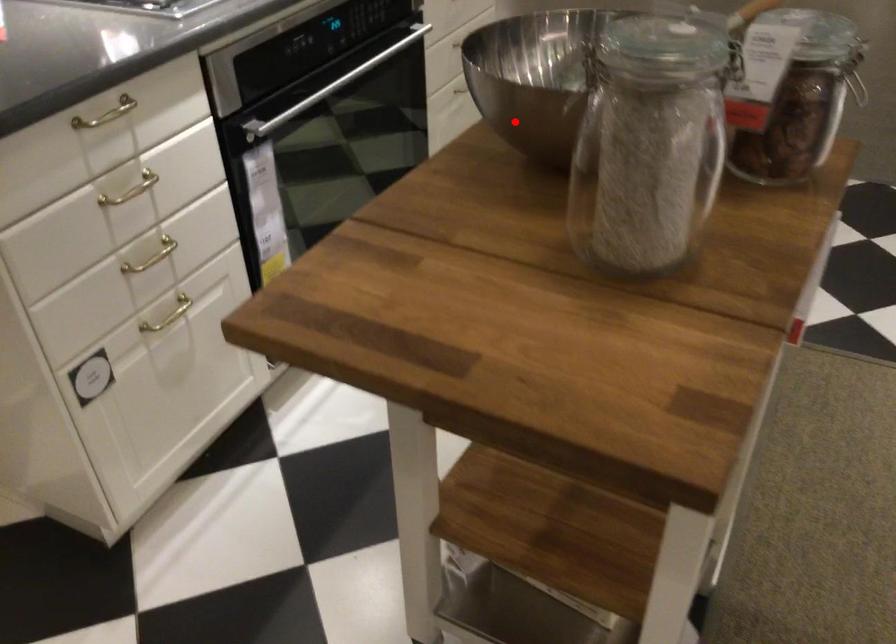
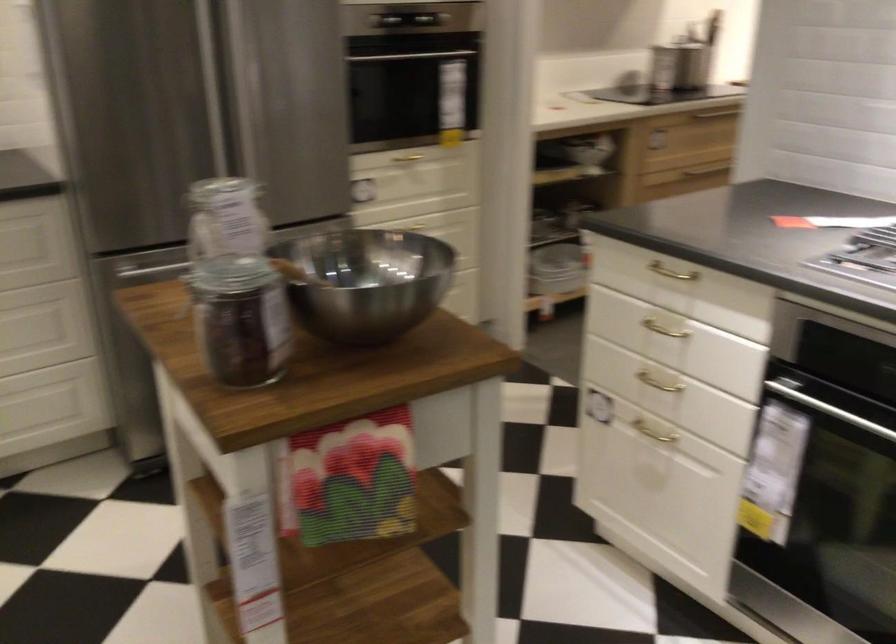
In the second image, find the point that corresponds to the highlighted location in the first image.

(366, 281)